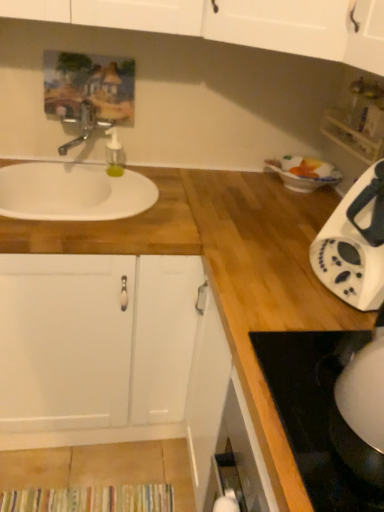
The image size is (384, 512). In order to click on vacant space situated on the left part of white glossy electric kettle at lower right in this screenshot , I will do `click(312, 416)`.